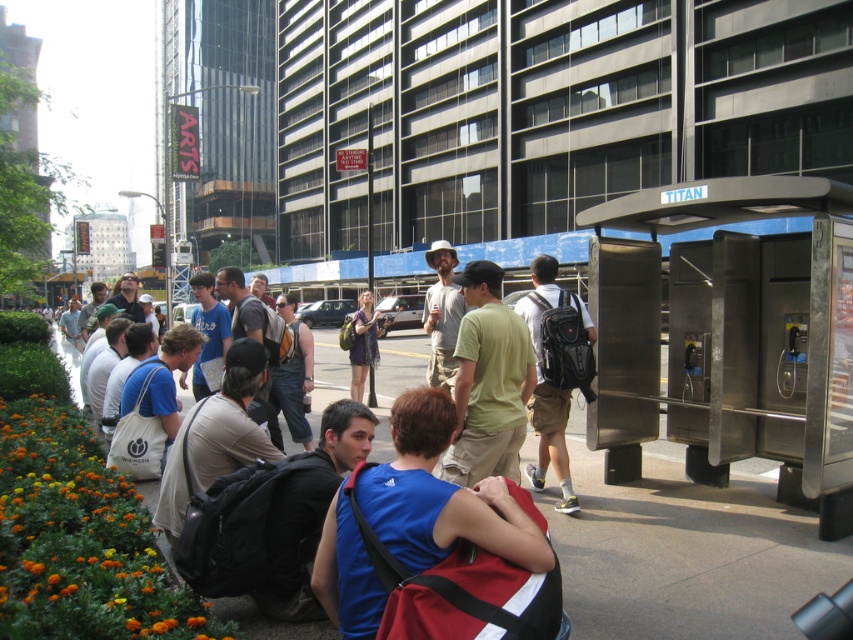
Question: Which object is closer to the camera taking this photo?

Choices:
 (A) dark gray backpack at center
 (B) khaki cotton pants at center

Answer: (A)

Question: Which point is farther to the camera?

Choices:
 (A) (219, 467)
 (B) (566, 307)

Answer: (B)

Question: Is khaki cotton pants at center positioned in front of matte purple dress at center?

Choices:
 (A) yes
 (B) no

Answer: (A)

Question: Is metallic silver bus stop at right thinner than khaki cotton pants at center?

Choices:
 (A) no
 (B) yes

Answer: (A)

Question: Which of the following is the closest to the observer?

Choices:
 (A) (15, 563)
 (B) (416, 570)
 (C) (305, 388)
 (D) (550, 433)

Answer: (B)

Question: Does dark gray backpack at center lie in front of khaki cotton pants at center?

Choices:
 (A) no
 (B) yes

Answer: (B)